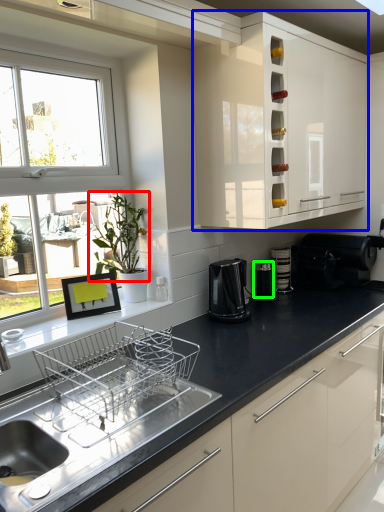
Question: Based on their relative distances, which object is nearer to plant (highlighted by a red box)? Choose from cabinetry (highlighted by a blue box) and appliance (highlighted by a green box).

Choices:
 (A) cabinetry
 (B) appliance

Answer: (A)